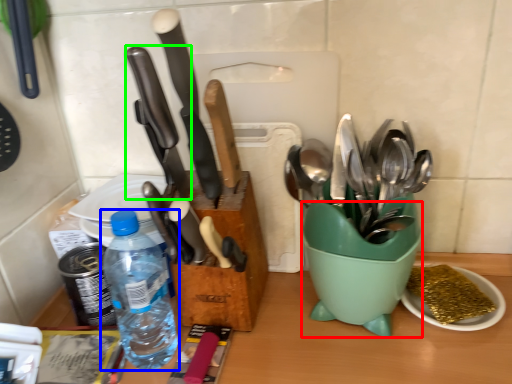
Question: Estimate the real-world distances between objects in this image. Which object is closer to mixing bowl (highlighted by a red box), bottle (highlighted by a blue box) or kitchen knife (highlighted by a green box)?

Choices:
 (A) bottle
 (B) kitchen knife

Answer: (B)